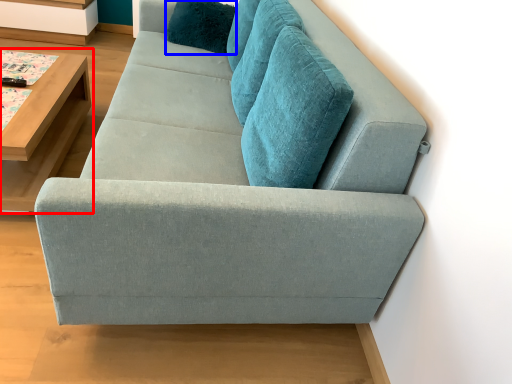
Question: Which object is closer to the camera taking this photo, table (highlighted by a red box) or pillow (highlighted by a blue box)?

Choices:
 (A) table
 (B) pillow

Answer: (A)